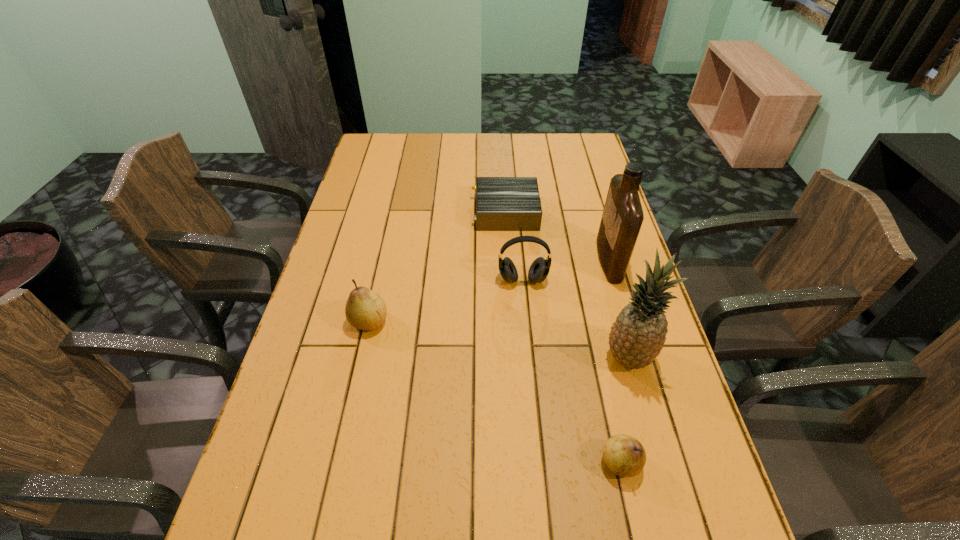
Where is `free spot between the nearer pear and the leftmost object`? The image size is (960, 540). free spot between the nearer pear and the leftmost object is located at coordinates (494, 392).

Identify the location of object that stands as the fifth closest to the shortest object. (625, 456).

Identify which object is the nearest to the nearest object. Please provide its 2D coordinates. Your answer should be formatted as a tuple, i.e. [(x, y)], where the tuple contains the x and y coordinates of a point satisfying the conditions above.

[(637, 337)]

Image resolution: width=960 pixels, height=540 pixels. I want to click on free point that satisfies the following two spatial constraints: 1. on the back panel of the farthest object; 2. on the back side of the second nearest object, so click(516, 357).

Where is `vacant position in the image that satisfies the following two spatial constraints: 1. on the ear cups of the pineapple; 2. on the left side of the headset`? Image resolution: width=960 pixels, height=540 pixels. vacant position in the image that satisfies the following two spatial constraints: 1. on the ear cups of the pineapple; 2. on the left side of the headset is located at coordinates (530, 357).

This screenshot has height=540, width=960. Identify the location of vacant space that satisfies the following two spatial constraints: 1. on the back side of the second nearest object; 2. on the back panel of the shortest object. click(x=588, y=212).

At what (x,y) coordinates should I click in order to perform the action: click on vacant point that satisfies the following two spatial constraints: 1. on the back panel of the farthest object; 2. on the front side of the farther pear. Please return your answer as a coordinate pair (x, y). Looking at the image, I should click on (513, 321).

At what (x,y) coordinates should I click in order to perform the action: click on blank area in the image that satisfies the following two spatial constraints: 1. on the ear cups of the headset; 2. on the left side of the shorter pear. Please return your answer as a coordinate pair (x, y). Looking at the image, I should click on (540, 462).

Locate an element on the screen. The image size is (960, 540). vacant region that satisfies the following two spatial constraints: 1. on the back panel of the farthest object; 2. on the back side of the second nearest object is located at coordinates (516, 357).